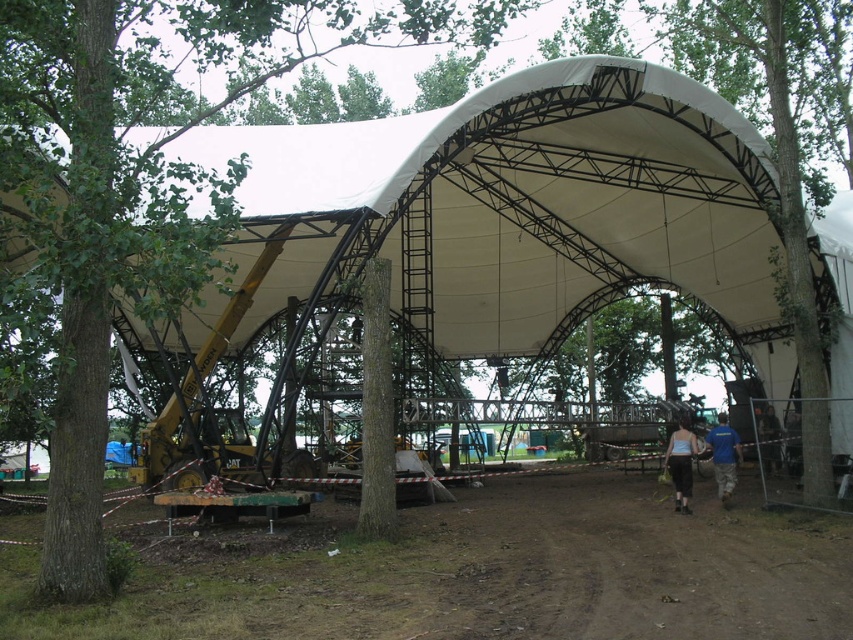
Is brown dirt track at lower center taller than dark blue shirt at lower right?

Indeed, brown dirt track at lower center has a greater height compared to dark blue shirt at lower right.

Does point (492, 547) come in front of point (764, 465)?

Yes.

What do you see at coordinates (477, 573) in the screenshot?
I see `brown dirt track at lower center` at bounding box center [477, 573].

What are the coordinates of `brown dirt track at lower center` in the screenshot? It's located at (477, 573).

From the picture: Is dark gray fabric pants at center closer to the viewer compared to blue fabric shirt at center?

Yes.

Is dark gray fabric pants at center below blue fabric shirt at center?

Yes, dark gray fabric pants at center is below blue fabric shirt at center.

What do you see at coordinates (682, 461) in the screenshot? The height and width of the screenshot is (640, 853). I see `dark gray fabric pants at center` at bounding box center [682, 461].

This screenshot has height=640, width=853. In order to click on dark gray fabric pants at center in this screenshot , I will do `click(682, 461)`.

How far apart are brown dirt track at lower center and dark gray fabric pants at center?

They are 7.64 meters apart.

Consider the image. Who is more distant from viewer, [346,540] or [679,477]?

The point [679,477] is behind.

Where is `brown dirt track at lower center`? This screenshot has width=853, height=640. brown dirt track at lower center is located at coordinates (477, 573).